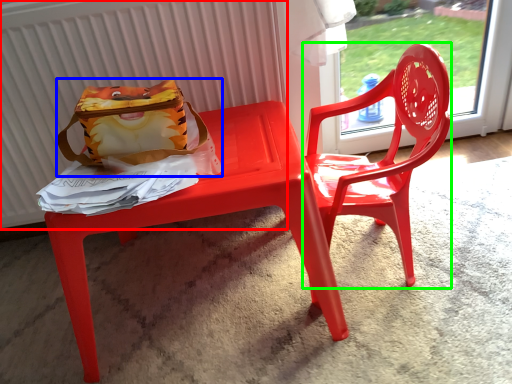
Question: Based on their relative distances, which object is farther from radiator (highlighted by a red box)? Choose from pouch (highlighted by a blue box) and chair (highlighted by a green box).

Choices:
 (A) pouch
 (B) chair

Answer: (B)